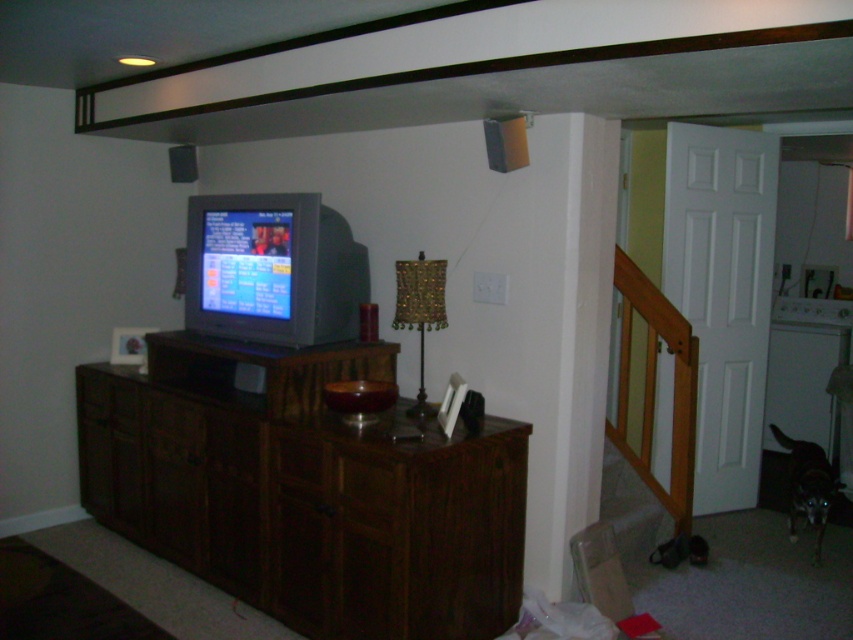
Question: Which object is closer to the camera taking this photo?

Choices:
 (A) brown wood drawer at center
 (B) dark wood dresser at center

Answer: (B)

Question: From the image, what is the correct spatial relationship of dark wood dresser at center in relation to brown wood drawer at center?

Choices:
 (A) above
 (B) below

Answer: (B)

Question: Among these objects, which one is farthest from the camera?

Choices:
 (A) dark wood dresser at center
 (B) matte gray tv at center
 (C) brown wood drawer at center

Answer: (B)

Question: Is dark wood dresser at center further to camera compared to brown wood drawer at center?

Choices:
 (A) yes
 (B) no

Answer: (B)

Question: Which object is positioned farthest from the dark wood dresser at center?

Choices:
 (A) matte gray tv at center
 (B) brown wood drawer at center

Answer: (A)

Question: Considering the relative positions of dark wood dresser at center and matte gray tv at center in the image provided, where is dark wood dresser at center located with respect to matte gray tv at center?

Choices:
 (A) below
 (B) above

Answer: (A)